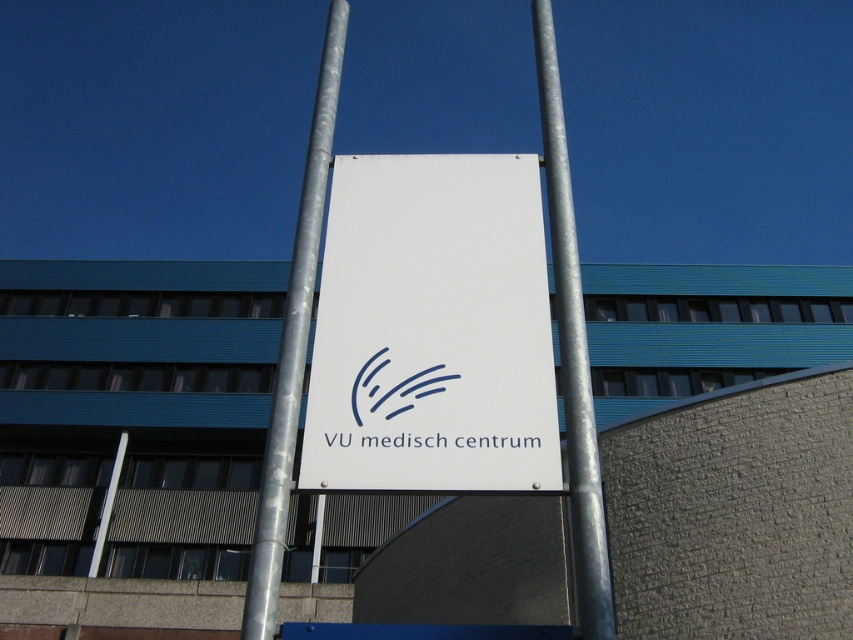
Question: Which point is farther from the camera taking this photo?

Choices:
 (A) (566, 355)
 (B) (323, 120)
 (C) (426, 288)

Answer: (B)

Question: Which point is closer to the camera taking this photo?

Choices:
 (A) (537, 406)
 (B) (589, 449)

Answer: (B)

Question: Does white matte sign at center appear on the left side of metallic silver pole at center?

Choices:
 (A) no
 (B) yes

Answer: (B)

Question: Is white matte sign at center above silver metallic pole at center?

Choices:
 (A) yes
 (B) no

Answer: (A)

Question: Can you confirm if metallic silver pole at center is thinner than silver metallic pole at center?

Choices:
 (A) yes
 (B) no

Answer: (A)

Question: Which of these objects is positioned closest to the silver metallic pole at center?

Choices:
 (A) white matte sign at center
 (B) metallic silver pole at center

Answer: (A)